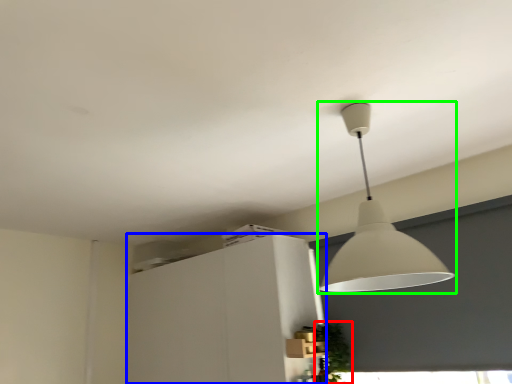
Question: Which object is the farthest from plant (highlighted by a red box)? Choose among these: cabinetry (highlighted by a blue box) or lamp (highlighted by a green box).

Choices:
 (A) cabinetry
 (B) lamp

Answer: (B)